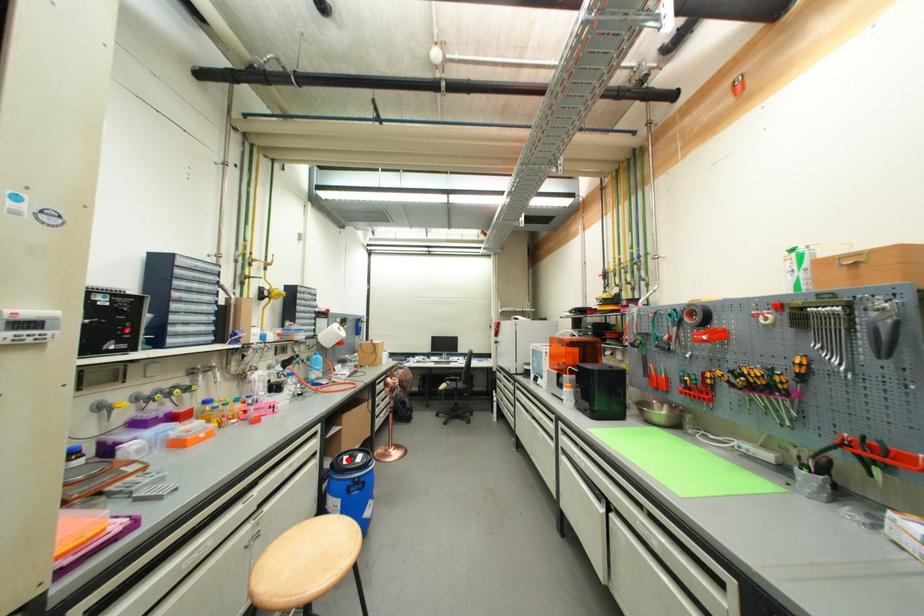
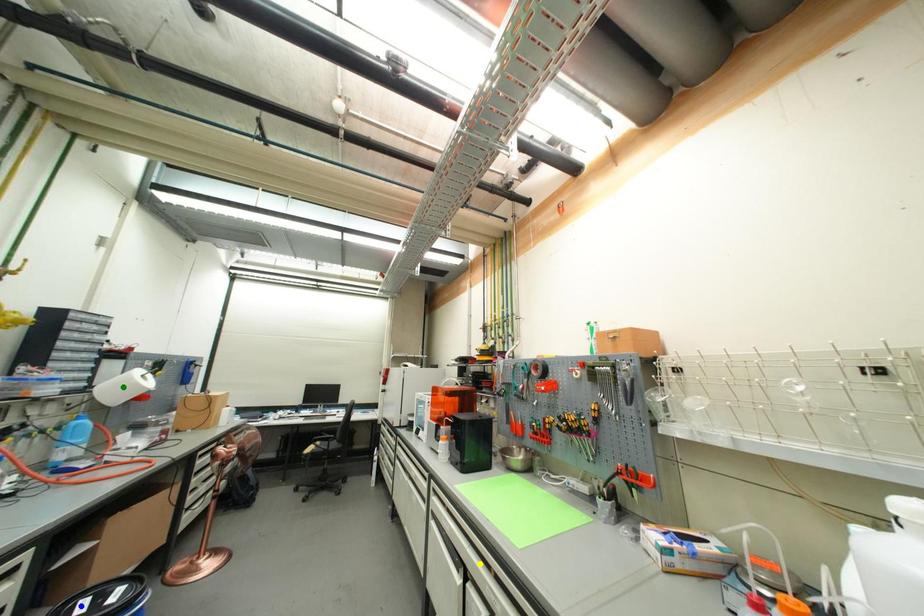
Question: I am providing you with two images of the same scene from different viewpoints. A red point is marked on the first image. You are given multiple points on the second image. Which mark in image 2 goes with the point in image 1?

Choices:
 (A) yellow point
 (B) green point
 (C) blue point

Answer: (C)